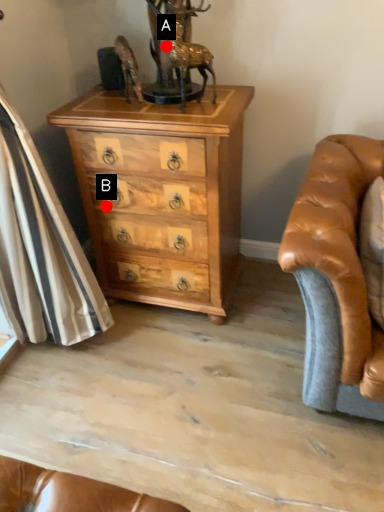
Question: Two points are circled on the image, labeled by A and B beside each circle. Among these points, which one is nearest to the camera?

Choices:
 (A) A is closer
 (B) B is closer

Answer: (A)